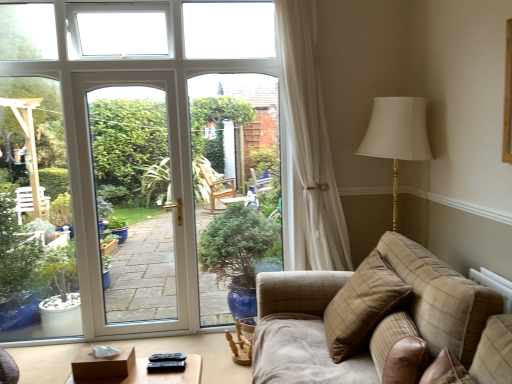
Image resolution: width=512 pixels, height=384 pixels. I want to click on brown plaid pillow at right, so click(362, 306).

What do you see at coordinates (362, 306) in the screenshot? I see `brown plaid pillow at right` at bounding box center [362, 306].

I want to click on brown plaid pillow at right, so click(362, 306).